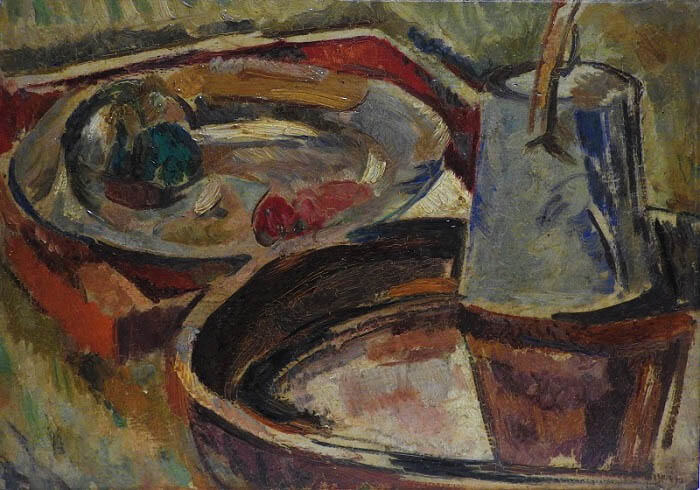
This screenshot has height=490, width=700. I want to click on bowl, so click(252, 415).